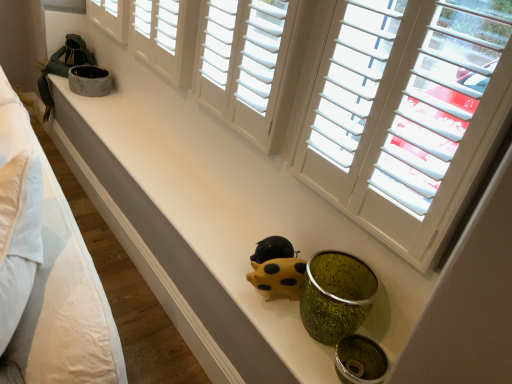
Question: Considering the positions of point (252, 276) and point (1, 157), is point (252, 276) closer or farther from the camera than point (1, 157)?

Choices:
 (A) closer
 (B) farther

Answer: (B)

Question: Is yellow matte piggy bank at center wider or thinner than white cotton bed at left?

Choices:
 (A) wide
 (B) thin

Answer: (B)

Question: Considering the real-world distances, which object is farthest from the white cotton bed at left?

Choices:
 (A) white wood shutters at upper center, which appears as the second window when viewed from the right
 (B) white matte window at upper center, which is counted as the second window, starting from the left
 (C) matte white counter top at center
 (D) yellow matte piggy bank at center

Answer: (B)

Question: Which of these objects is positioned farthest from the yellow matte piggy bank at center?

Choices:
 (A) white matte window at upper center, positioned as the first window in right-to-left order
 (B) matte white counter top at center
 (C) white wood shutters at upper center, which appears as the second window when viewed from the right
 (D) white cotton bed at left

Answer: (D)